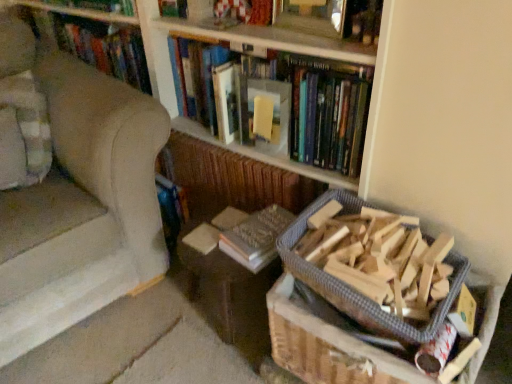
This screenshot has width=512, height=384. Identify the location of free region on the left part of yellow paper at upper center. (226, 150).